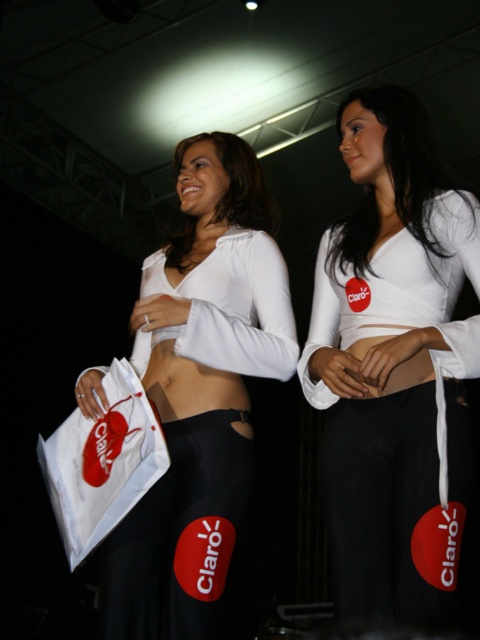
Which is in front, point (321, 250) or point (47, 465)?

Point (47, 465) is more forward.

Does white matte fabric top at center appear over white paper bag at center?

Yes.

Who is more distant from viewer, (455, 609) or (137, 429)?

The point (137, 429) is behind.

What are the coordinates of `white matte fabric top at center` in the screenshot? It's located at (394, 365).

Between white matte top at center and white paper bag at center, which one has more height?

white matte top at center

Which is below, white matte top at center or white paper bag at center?

white paper bag at center is lower down.

Is point (205, 556) positioned before point (118, 476)?

No, (205, 556) is behind (118, 476).

The height and width of the screenshot is (640, 480). In order to click on white matte top at center in this screenshot , I will do `click(200, 392)`.

This screenshot has width=480, height=640. What do you see at coordinates (394, 365) in the screenshot? I see `white matte fabric top at center` at bounding box center [394, 365].

Is point (464, 422) positioned behind point (142, 636)?

Yes, it is.

You are a GUI agent. You are given a task and a screenshot of the screen. Output one action in this format:
    pyautogui.click(x=<x>, y=<y>)
    Task: Click on the white matte fabric top at center
    
    Given the screenshot: What is the action you would take?
    pyautogui.click(x=394, y=365)